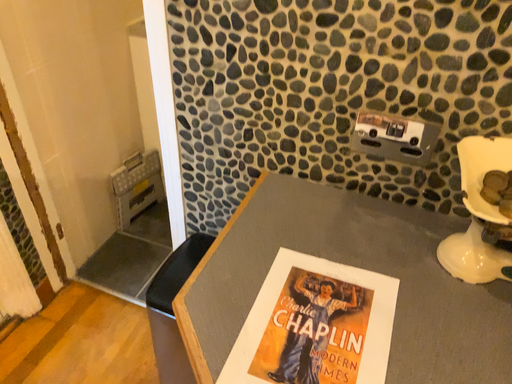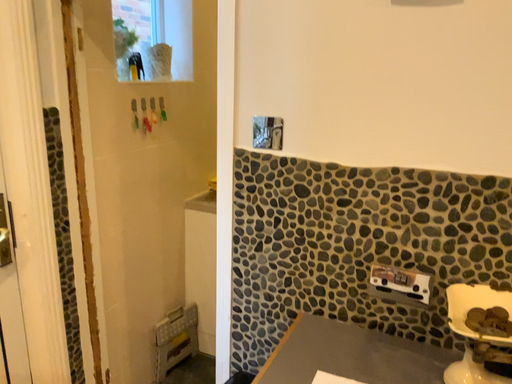
Question: Which way did the camera rotate in the video?

Choices:
 (A) rotated downward
 (B) rotated upward

Answer: (B)